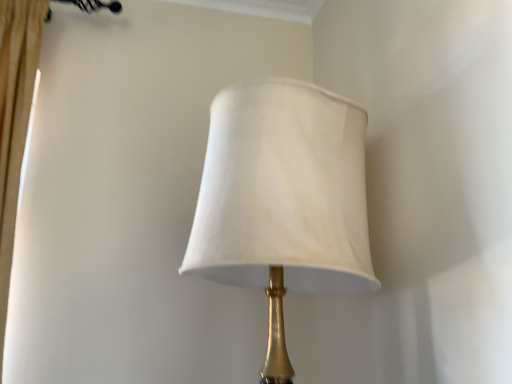
The height and width of the screenshot is (384, 512). Find the location of `white fabric lampshade at center`. white fabric lampshade at center is located at coordinates (283, 199).

Measure the distance between white fabric lampshade at center and camera.

The depth of white fabric lampshade at center is 29.54 inches.

Describe the element at coordinates (283, 199) in the screenshot. Image resolution: width=512 pixels, height=384 pixels. I see `white fabric lampshade at center` at that location.

Identify the location of white fabric lampshade at center. The image size is (512, 384). (283, 199).